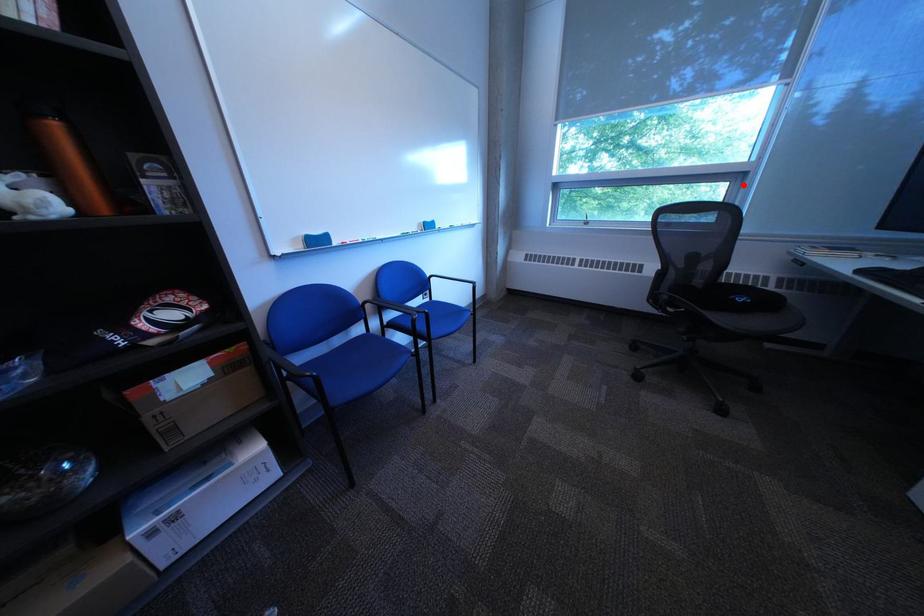
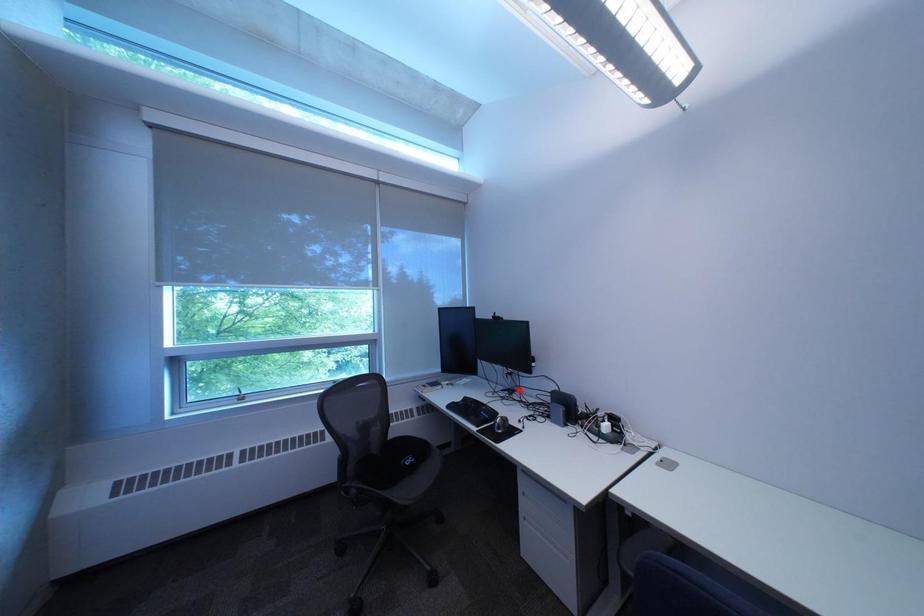
I am providing you with two images of the same scene from different viewpoints. A red point is marked on the first image and another point is marked on the second image. Is the marked point in image1 the same physical position as the marked point in image2?

No